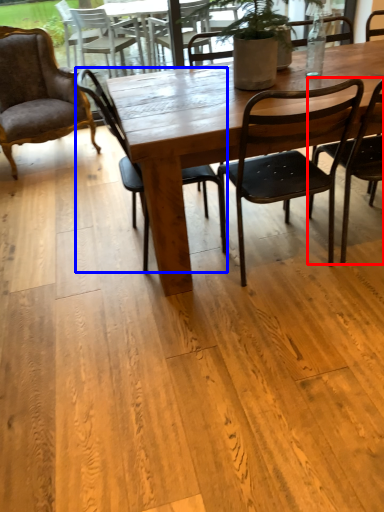
Question: Which object is closer to the camera taking this photo, chair (highlighted by a red box) or chair (highlighted by a blue box)?

Choices:
 (A) chair
 (B) chair

Answer: (A)